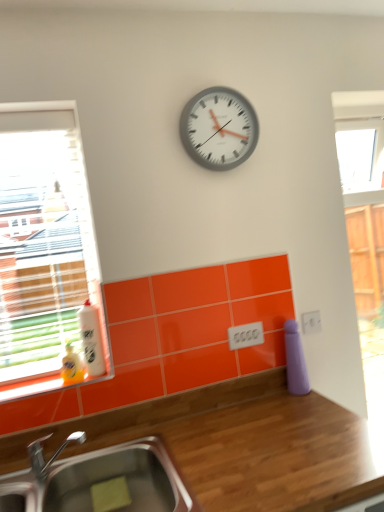
Where is `vacant space situated on the left part of white glossy bottle at left`? vacant space situated on the left part of white glossy bottle at left is located at coordinates (34, 379).